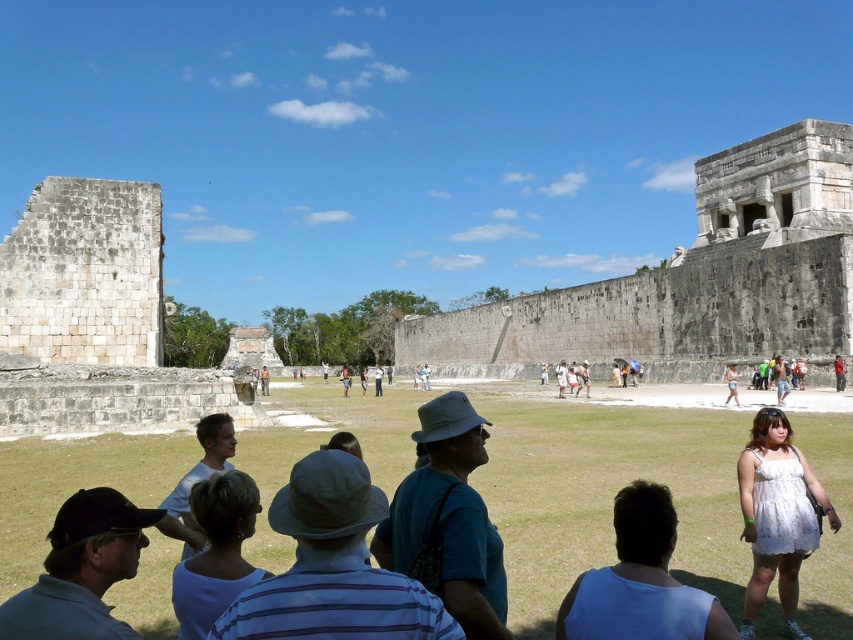
Based on the photo, you are standing at the archaeological site and want to reach the point marked as point (32, 609). If your walking speed is 1.5 meters per second, how many seconds will it take you to reach that point?

The point (32, 609) is 24.06 meters away from the viewer. At a walking speed of 1.5 meters per second, it would take approximately 16.04 seconds to reach it.

You are a tour guide leading a group at the archaeological site. You notice a tourist wearing a dark blue shirt at center and a camera. How far apart are these two items?

The dark blue shirt at center and the camera are 28.18 meters apart from each other.

You are a tour guide at the archaeological site and need to ensure that all visitors are within earshot for your guided tour. The dark blue shirt at center and the white cotton dress at lower right are two of your visitors. Given that the maximum effective speaking distance for a tour guide is 150 feet, can you clearly hear both visitors if they shout from their current positions?

The distance between the dark blue shirt at center and the white cotton dress at lower right is 161.98 feet. Since this exceeds the 150 feet limit, the tour guide may not be able to hear both visitors clearly if they shout from their current positions.